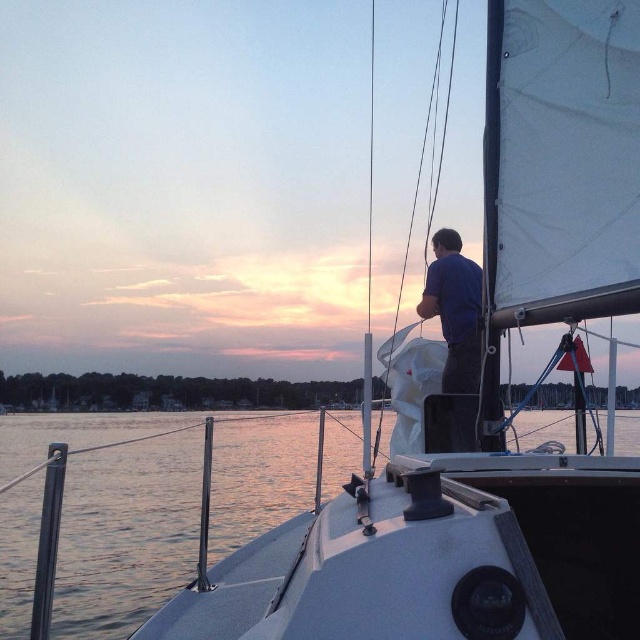
You are standing on the deck of the sailboat and want to take a photo of the clear water at lower left. Where should you point your camera to capture it?

You should point your camera towards the lower left area at coordinates point (125,531) to capture the clear water at lower left.

You are standing on the deck of the sailboat and want to move from the clear water at lower left to the dark blue shirt at upper center. Which direction should you move?

You should move to the right because the clear water at lower left is to the left of the dark blue shirt at upper center, so moving right will take you towards it.